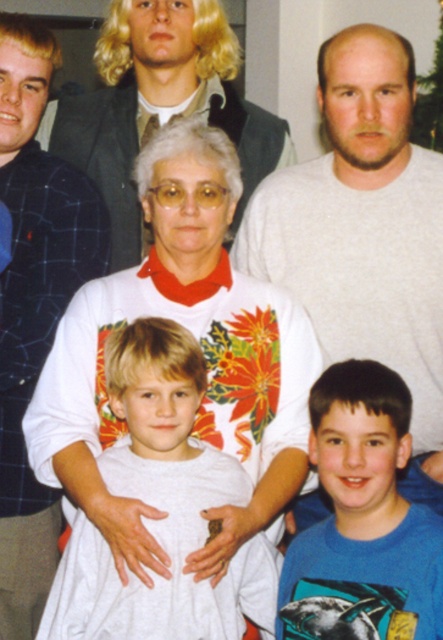
What is located at the coordinates point (x=162, y=508)?

The white cotton shirt at center is located at point (x=162, y=508).